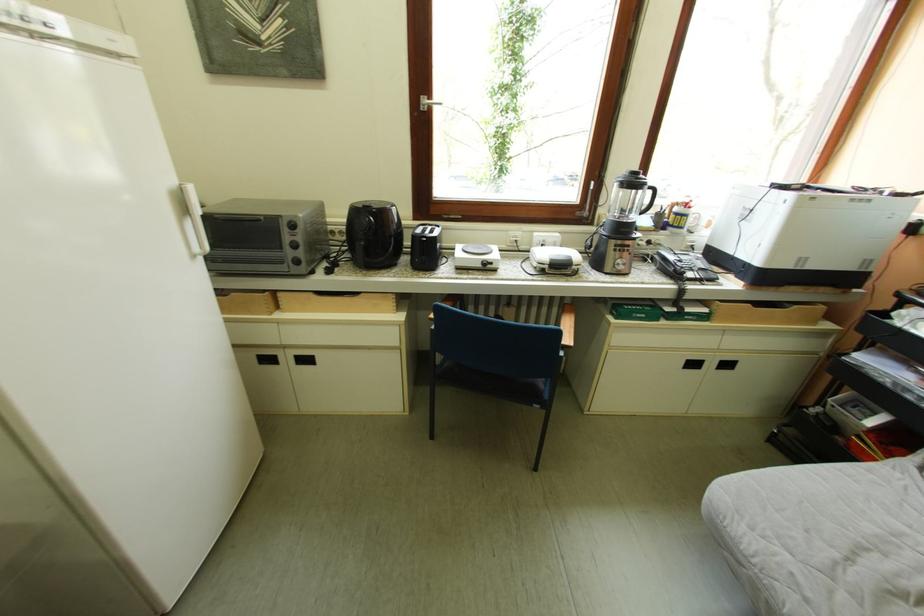
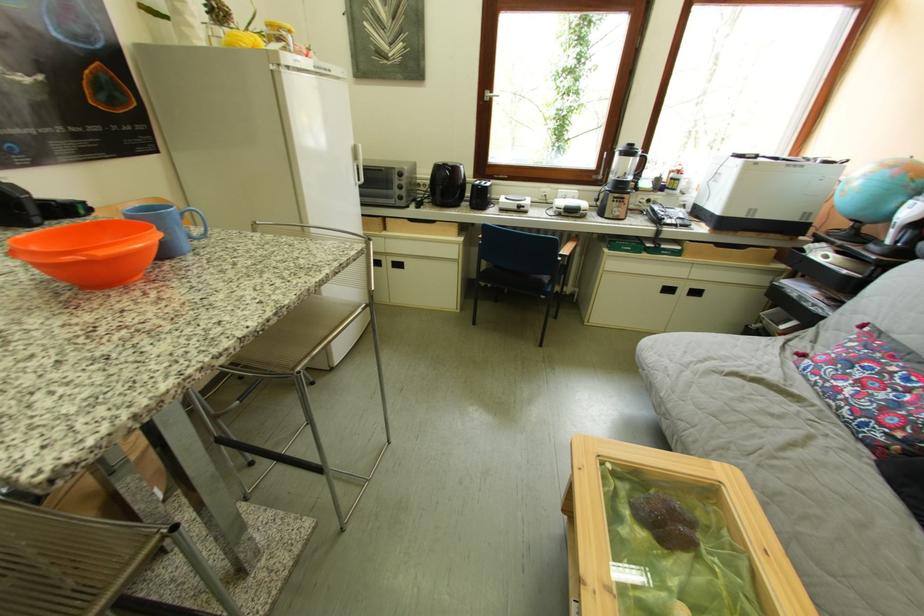
Locate, in the second image, the point that corresponds to pixel 718 313 in the first image.

(690, 251)